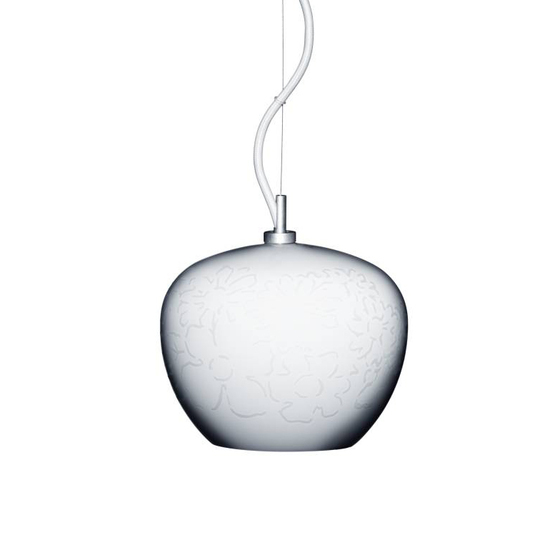
Locate an element on the screen. top of lampshade is located at coordinates (283, 242).